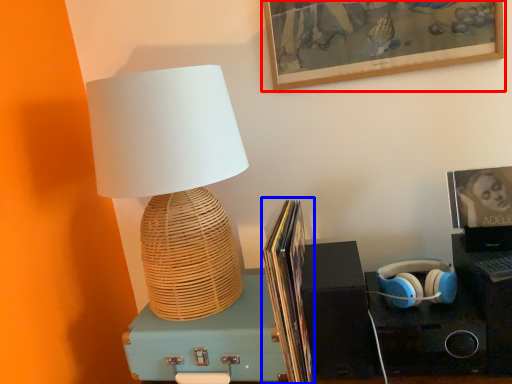
Question: Which object is further to the camera taking this photo, picture frame (highlighted by a red box) or book (highlighted by a blue box)?

Choices:
 (A) picture frame
 (B) book

Answer: (A)